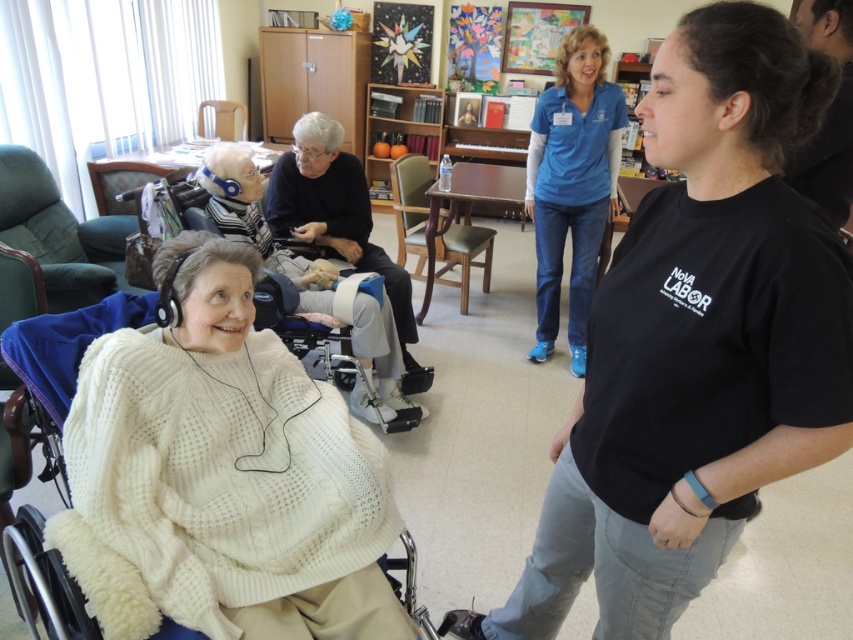
Question: Which point is closer to the camera taking this photo?

Choices:
 (A) (196, 305)
 (B) (341, 342)

Answer: (A)

Question: Which object is the farthest from the black fabric chair at center?

Choices:
 (A) black cotton shirt at center
 (B) white cable-knit sweater at center

Answer: (A)

Question: Which object is positioned farthest from the white knitted wheelchair at lower left?

Choices:
 (A) black fabric chair at center
 (B) blue cotton shirt at center
 (C) black cotton shirt at center

Answer: (C)

Question: Can you confirm if black fabric chair at center is bigger than white knitted wheelchair at lower left?

Choices:
 (A) no
 (B) yes

Answer: (A)

Question: Does black cotton shirt at center have a larger size compared to white knitted wheelchair at lower left?

Choices:
 (A) no
 (B) yes

Answer: (B)

Question: Is white cable-knit sweater at center bigger than blue cotton shirt at center?

Choices:
 (A) yes
 (B) no

Answer: (B)